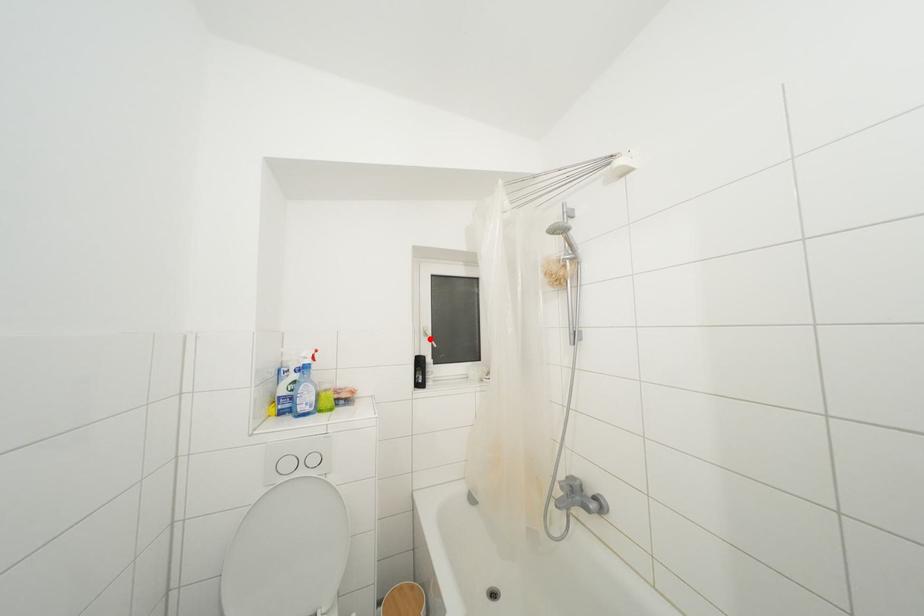
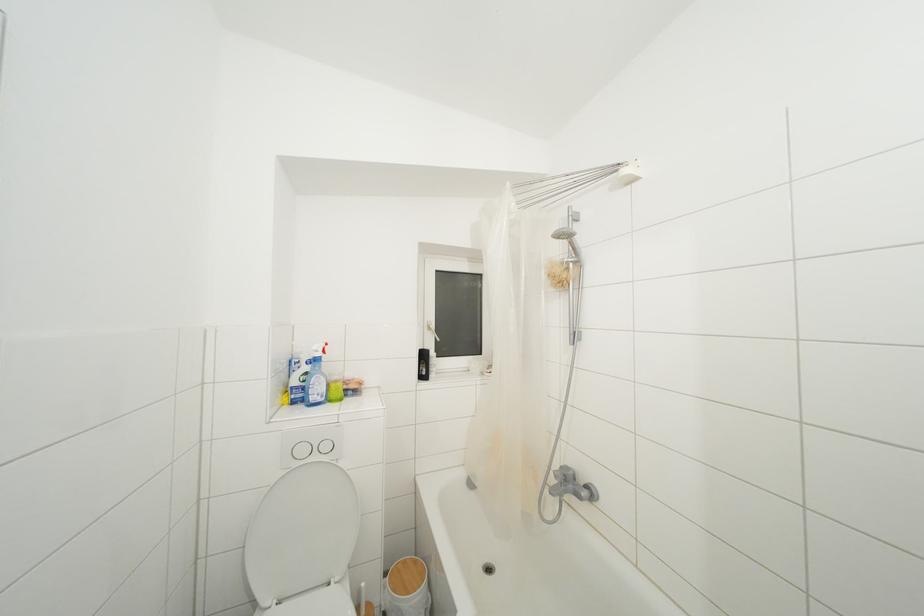
The point at the highlighted location is marked in the first image. Where is the corresponding point in the second image?

(433, 333)